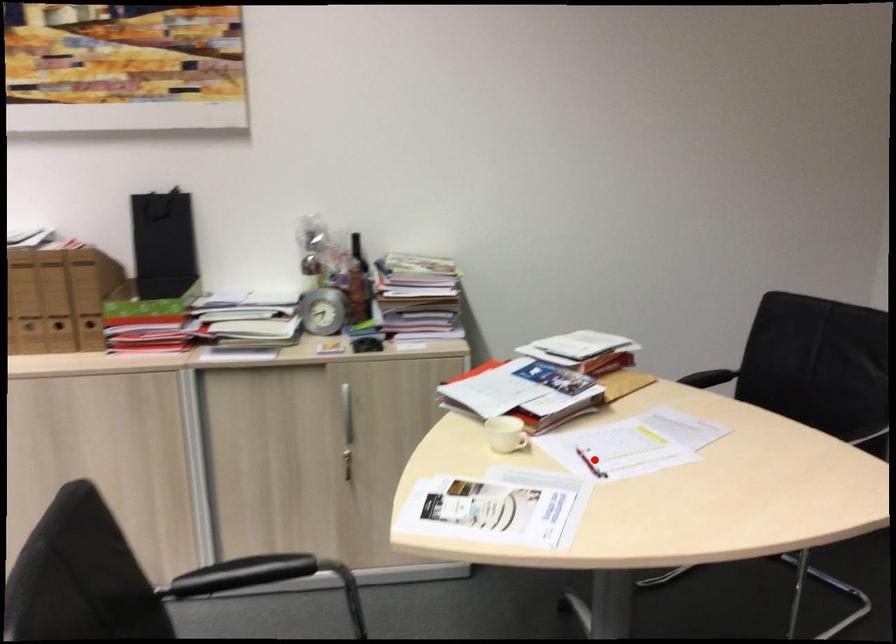
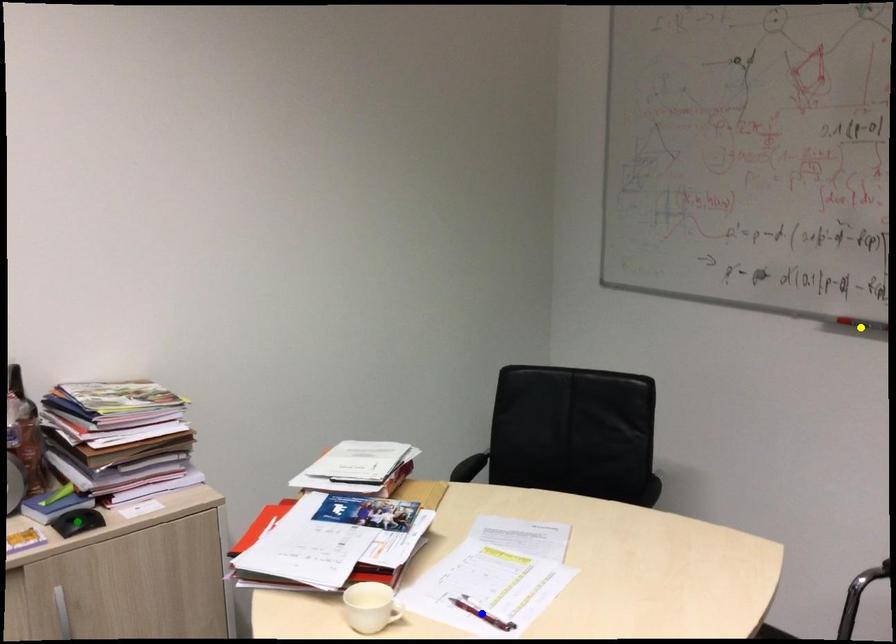
Question: I am providing you with two images of the same scene from different viewpoints. A red point is marked on the first image. You are given multiple points on the second image. In image 2, which mark is for the same physical point as the one in image 1?

Choices:
 (A) green point
 (B) blue point
 (C) yellow point

Answer: (B)